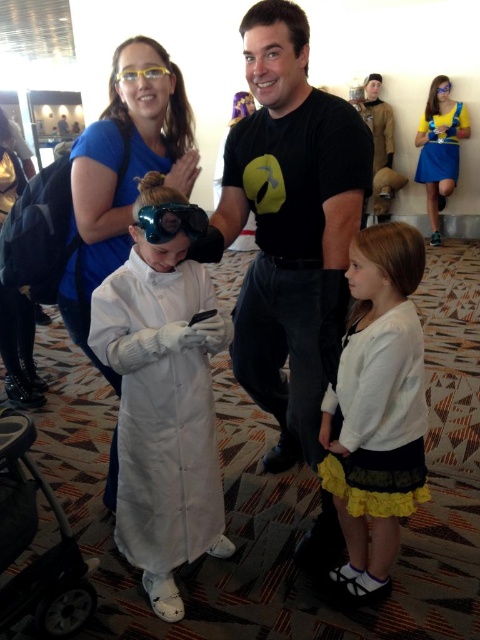
Looking at the scene, where is the white soft sweater at center in relation to the blue satin dress at upper right?

The white soft sweater at center is to the left of the blue satin dress at upper right.